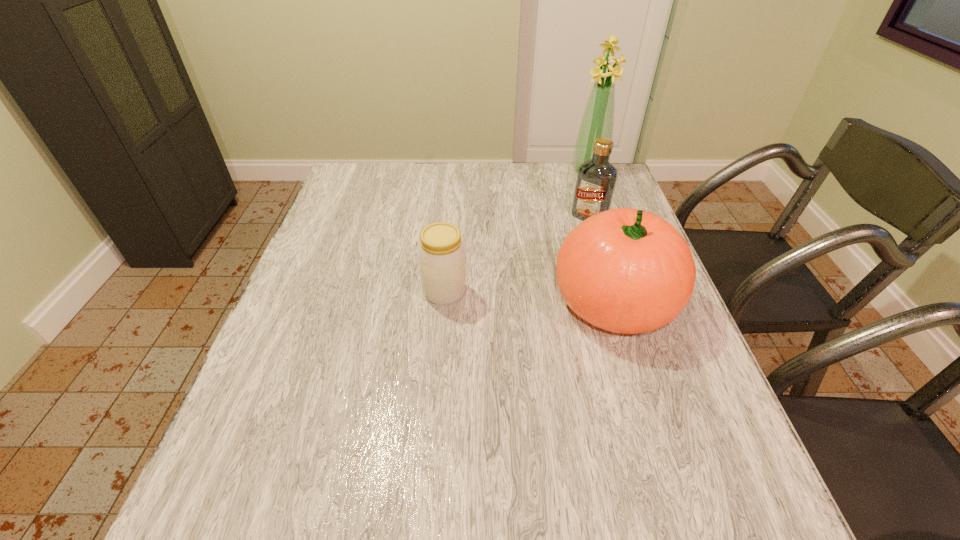
This screenshot has width=960, height=540. What are the coordinates of `the leftmost object` in the screenshot? It's located at (441, 253).

Locate an element on the screen. jar is located at coordinates (441, 253).

Image resolution: width=960 pixels, height=540 pixels. In order to click on pumpkin in this screenshot , I will do `click(624, 270)`.

This screenshot has width=960, height=540. I want to click on vodka, so click(596, 179).

The image size is (960, 540). Identify the location of bouquet. (598, 119).

Where is `the farthest object`? This screenshot has height=540, width=960. the farthest object is located at coordinates (598, 119).

Identify the location of free region located on the right of the shortest object. Image resolution: width=960 pixels, height=540 pixels. (520, 292).

Locate an element on the screen. The image size is (960, 540). free space located on the back of the pumpkin is located at coordinates (588, 215).

You are a GUI agent. You are given a task and a screenshot of the screen. Output one action in this format:
    pyautogui.click(x=<x>, y=<y>)
    Task: Click on the free space located 0.190m on the front-facing side of the vodka
    The width and height of the screenshot is (960, 540).
    Given the screenshot: What is the action you would take?
    pyautogui.click(x=552, y=260)

The image size is (960, 540). Identify the location of vacant space located 0.320m on the front-facing side of the vodka. (528, 290).